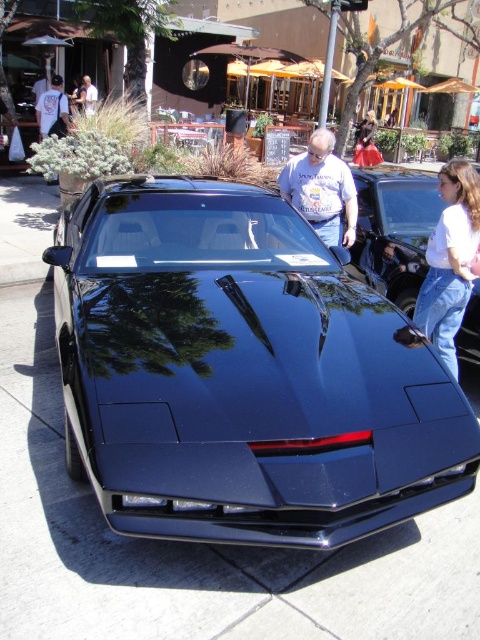
This screenshot has height=640, width=480. Describe the element at coordinates (202, 232) in the screenshot. I see `glossy black windshield at center` at that location.

Is point (267, 200) in front of point (300, 198)?

Yes, point (267, 200) is in front of point (300, 198).

You are a GUI agent. You are given a task and a screenshot of the screen. Output one action in this format:
    pyautogui.click(x=<x>, y=<y>)
    Task: Click on the glossy black windshield at center
    The width and height of the screenshot is (480, 640).
    Given the screenshot: What is the action you would take?
    pyautogui.click(x=202, y=232)

Who is positioned more to the right, glossy black sports car at center or glossy black windshield at center?

glossy black sports car at center

Does glossy black sports car at center lie behind glossy black windshield at center?

That is False.

You are a GUI agent. You are given a task and a screenshot of the screen. Output one action in this format:
    pyautogui.click(x=<x>, y=<y>)
    Task: Click on the glossy black sports car at center
    This screenshot has height=640, width=480.
    Given the screenshot: What is the action you would take?
    pyautogui.click(x=241, y=372)

Where is `glossy black sports car at center`? The image size is (480, 640). glossy black sports car at center is located at coordinates (241, 372).

Which is below, glossy black windshield at center or velvet red dress at center?

glossy black windshield at center is lower down.

Is glossy black windshield at center taller than velvet red dress at center?

In fact, glossy black windshield at center may be shorter than velvet red dress at center.

Who is more forward, (195, 218) or (370, 118)?

Point (195, 218)

This screenshot has width=480, height=640. I want to click on glossy black windshield at center, so click(202, 232).